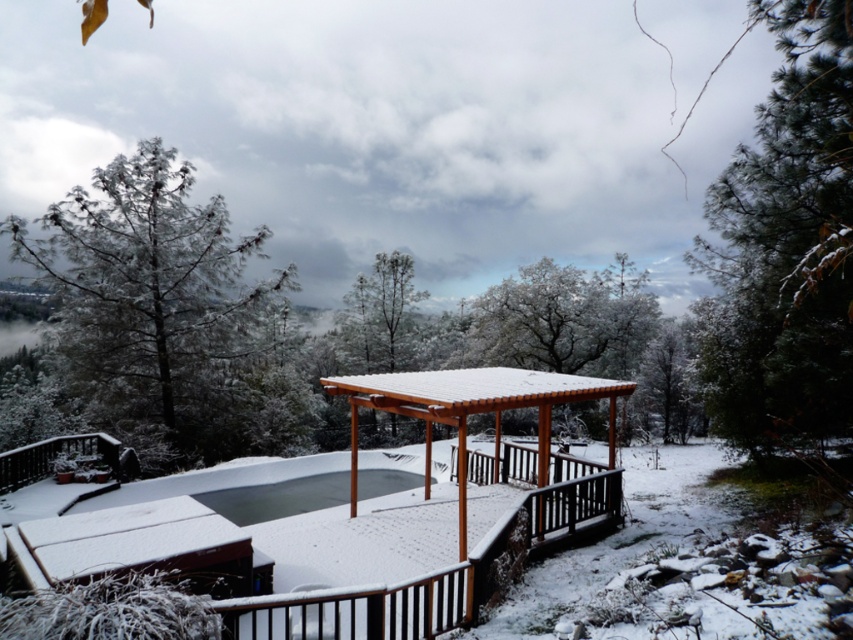
Does snow-covered pine tree at left have a lesser height compared to snow-covered wooden tree at center?

No.

Locate an element on the screen. This screenshot has width=853, height=640. snow-covered pine tree at left is located at coordinates (148, 300).

Locate an element on the screen. snow-covered pine tree at left is located at coordinates (148, 300).

Measure the distance from wooden pergola at center to snow-covered wooden tree at center.

wooden pergola at center is 75.53 feet away from snow-covered wooden tree at center.

Who is higher up, wooden pergola at center or snow-covered wooden tree at center?

Positioned higher is snow-covered wooden tree at center.

Does point (405, 401) come in front of point (363, 339)?

Yes.

Where is `wooden pergola at center`? wooden pergola at center is located at coordinates (354, 524).

Looking at this image, can you confirm if snow-covered pine at right is wider than snow-covered wooden tree at center?

Indeed, snow-covered pine at right has a greater width compared to snow-covered wooden tree at center.

This screenshot has width=853, height=640. Describe the element at coordinates (786, 246) in the screenshot. I see `snow-covered pine at right` at that location.

Where is `snow-covered pine at right`? snow-covered pine at right is located at coordinates (786, 246).